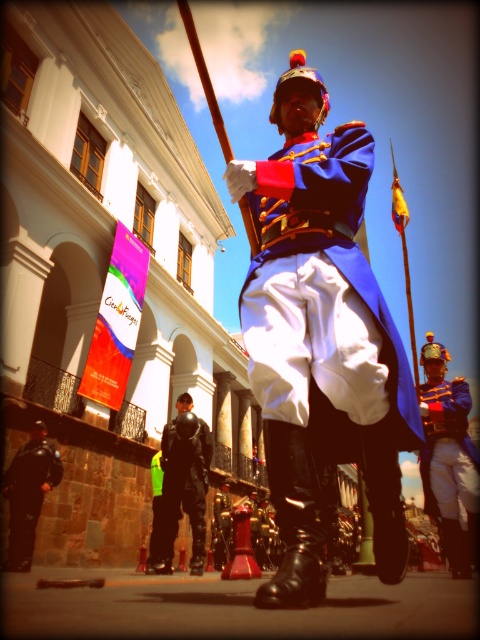
Does black leather jacket at lower center come behind black leather pants at lower left?

Yes, black leather jacket at lower center is further from the viewer.

Which is more to the right, black leather jacket at lower center or black leather pants at lower left?

black leather jacket at lower center is more to the right.

Is point (179, 477) positioned in front of point (25, 547)?

No.

You are a GUI agent. You are given a task and a screenshot of the screen. Output one action in this format:
    pyautogui.click(x=<x>, y=<y>)
    Task: Click on the black leather jacket at lower center
    
    Given the screenshot: What is the action you would take?
    pyautogui.click(x=181, y=486)

Can you confirm if blue glossy uniform at center is positioned below black leather pants at lower left?

Actually, blue glossy uniform at center is above black leather pants at lower left.

Does blue glossy uniform at center have a smaller size compared to black leather pants at lower left?

Actually, blue glossy uniform at center might be larger than black leather pants at lower left.

Is point (384, 449) less distant than point (10, 547)?

That is True.

Identify the location of blue glossy uniform at center. (321, 337).

Which is more to the left, blue glossy uniform at center or matte blue uniform at center?

blue glossy uniform at center

This screenshot has height=640, width=480. Describe the element at coordinates (321, 337) in the screenshot. I see `blue glossy uniform at center` at that location.

At what (x,y) coordinates should I click in order to perform the action: click on blue glossy uniform at center. Please return your answer as a coordinate pair (x, y). The height and width of the screenshot is (640, 480). Looking at the image, I should click on (321, 337).